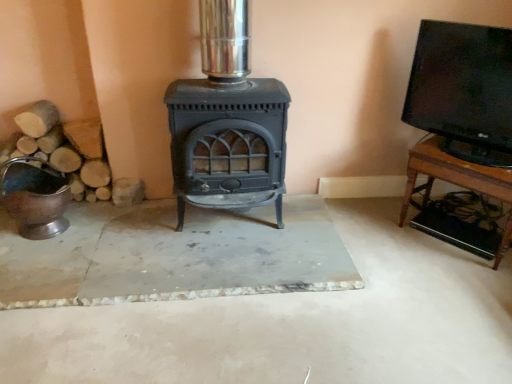
Locate an element on the screen. free space in front of wooden tv stand at right is located at coordinates (460, 281).